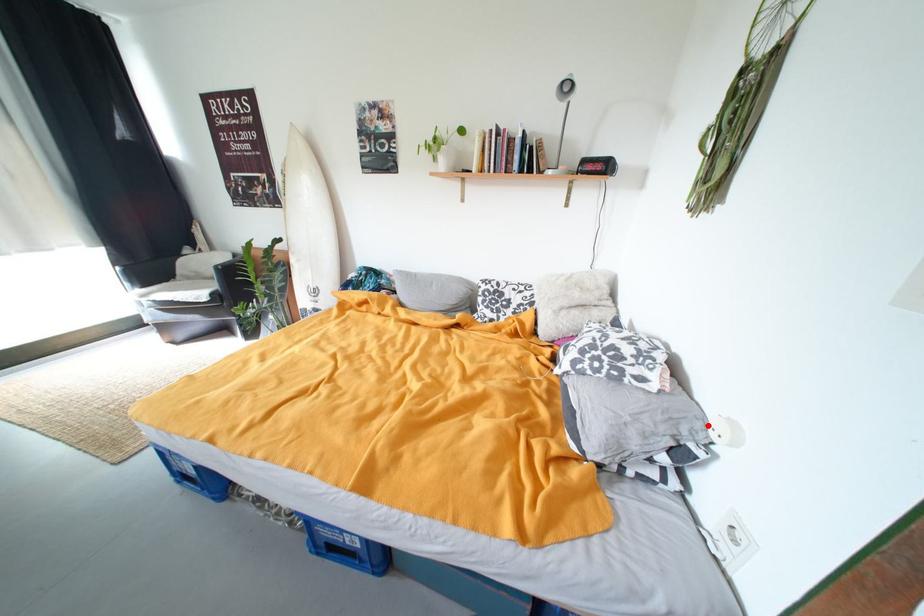
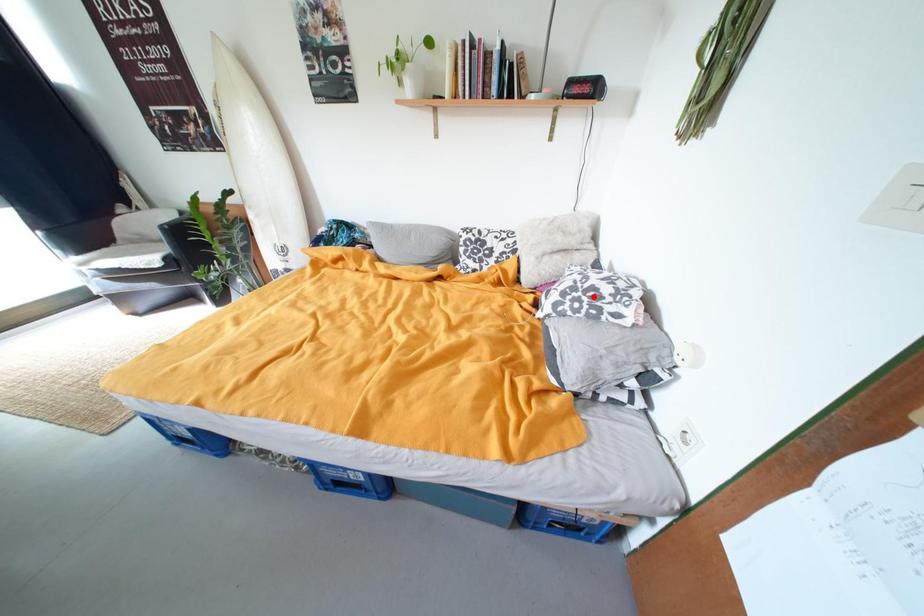
I am providing you with two images of the same scene from different viewpoints. A red point is marked on the first image and another point is marked on the second image. Do the highlighted points in image1 and image2 indicate the same real-world spot?

No